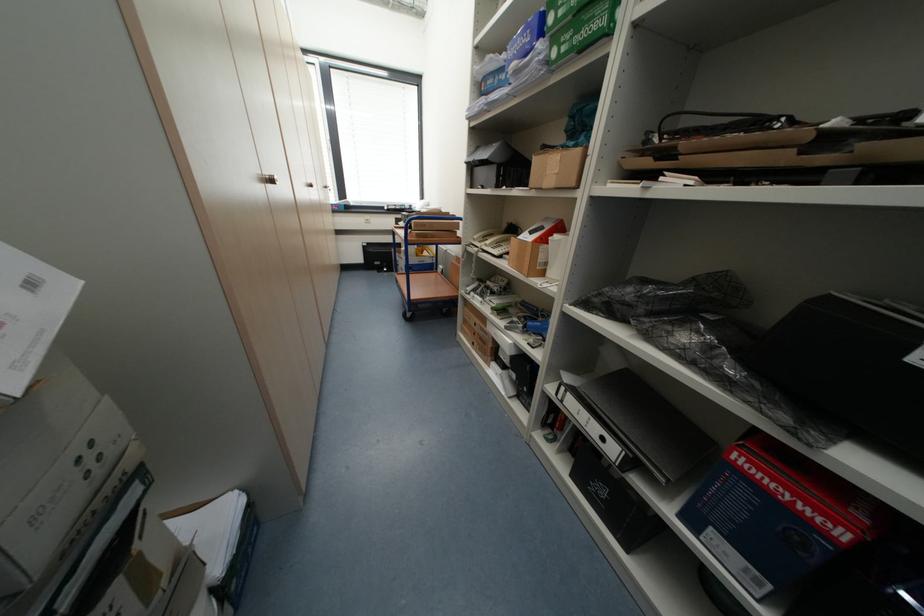
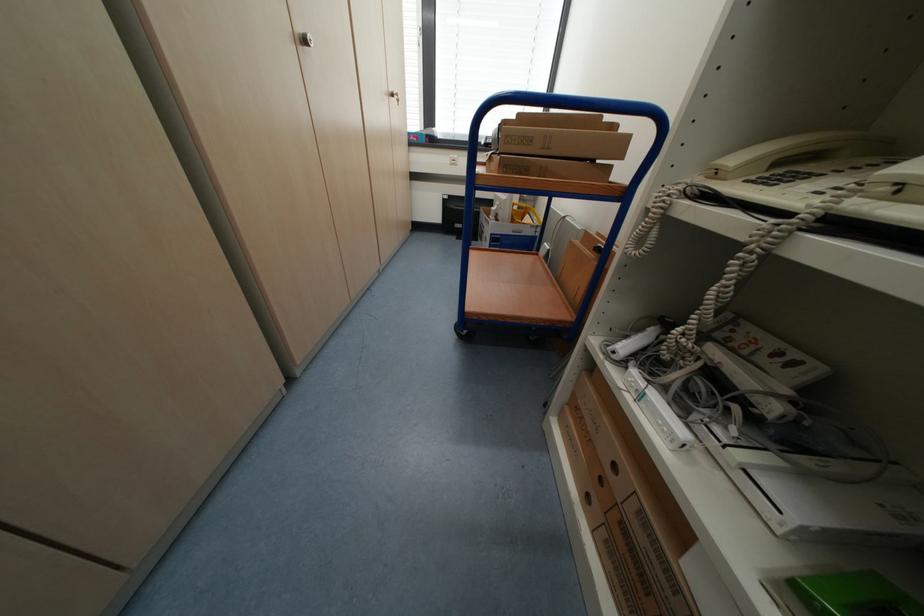
In the second image, find the point that corresponds to (464,227) in the first image.

(627, 148)